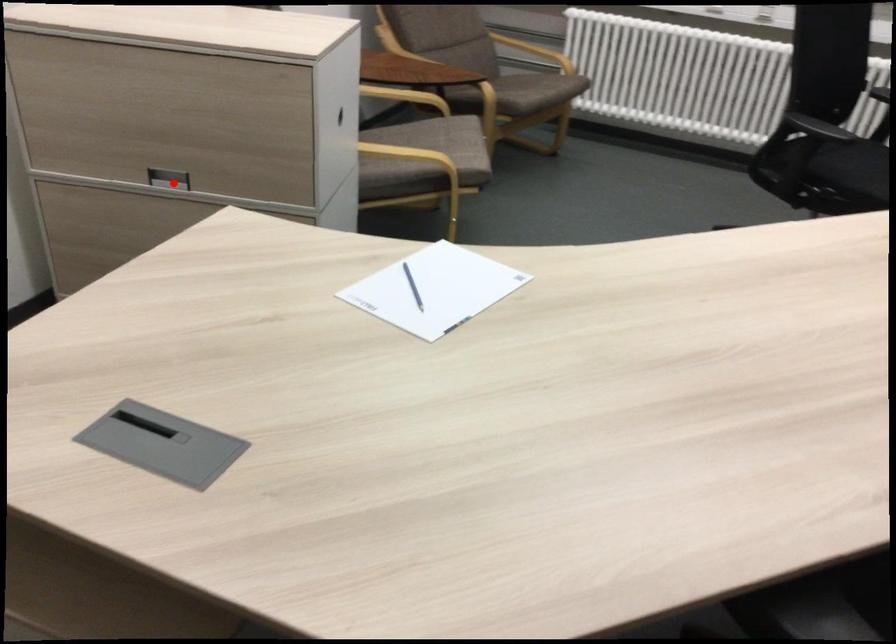
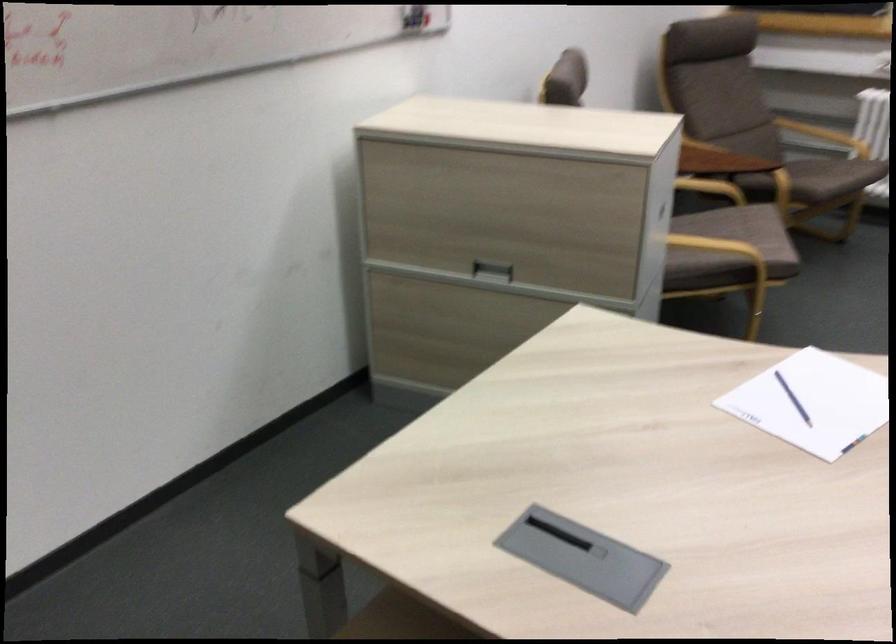
Find the pixel in the second image that matches the highlighted location in the first image.

(492, 270)